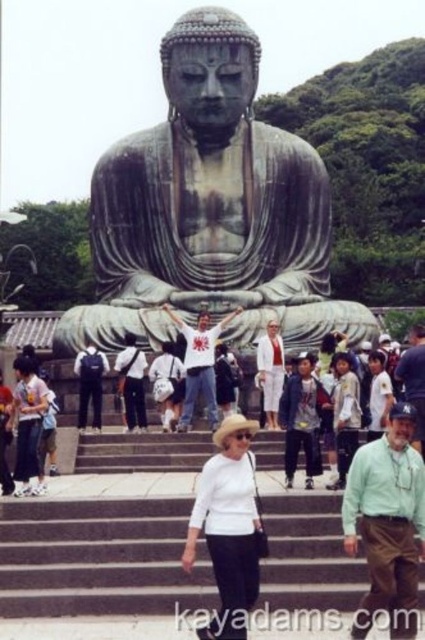
Question: Considering the relative positions of green patina statue at center and gray concrete stairs at center in the image provided, where is green patina statue at center located with respect to gray concrete stairs at center?

Choices:
 (A) left
 (B) right

Answer: (B)

Question: Is white fabric at center positioned behind matte black backpack at center?

Choices:
 (A) no
 (B) yes

Answer: (B)

Question: Among these objects, which one is farthest from the camera?

Choices:
 (A) matte black backpack at center
 (B) green cotton shirt at center
 (C) white cotton shirt at lower left
 (D) white cotton shirt at center

Answer: (D)

Question: Which point is closer to the camera taking this photo?

Choices:
 (A) (257, 572)
 (B) (218, 138)

Answer: (A)

Question: From the image, what is the correct spatial relationship of green patina statue at center in relation to matte black backpack at center?

Choices:
 (A) left
 (B) right

Answer: (B)

Question: Estimate the real-world distances between objects in this image. Which object is farther from the white cotton shirt at center?

Choices:
 (A) gray concrete stairs at center
 (B) white matte hat at center
 (C) white fabric at center
 (D) green patina statue at center

Answer: (B)